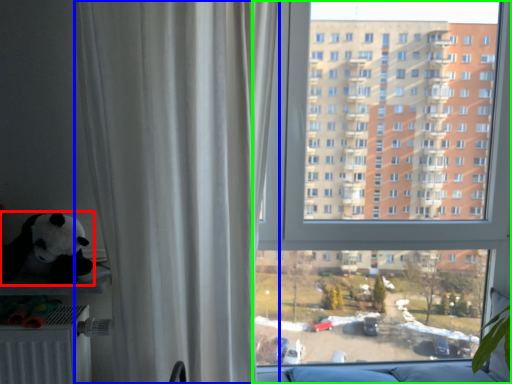
Question: Which is farther away from toy (highlighted by a red box)? curtain (highlighted by a blue box) or window (highlighted by a green box)?

Choices:
 (A) curtain
 (B) window

Answer: (B)